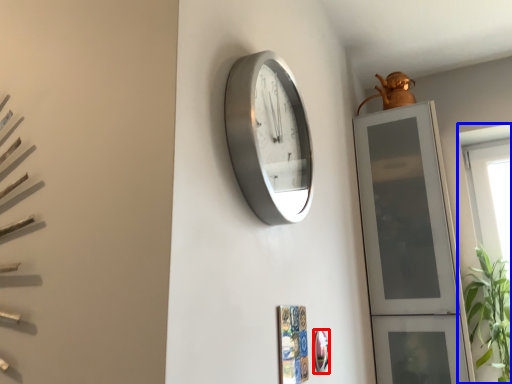
Question: Which object appears farthest to the camera in this image, mirror (highlighted by a red box) or window (highlighted by a blue box)?

Choices:
 (A) mirror
 (B) window

Answer: (B)